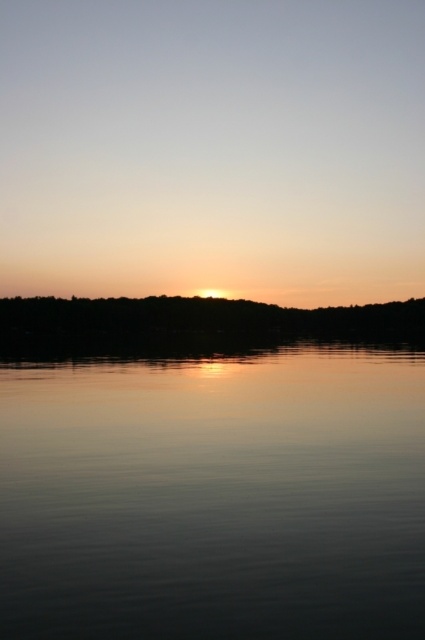
Question: Can you confirm if smooth water at center is wider than golden reflective sky at center?

Choices:
 (A) yes
 (B) no

Answer: (B)

Question: Which of the following is the closest to the observer?

Choices:
 (A) golden reflective sky at center
 (B) smooth water at center

Answer: (B)

Question: Which object appears closest to the camera in this image?

Choices:
 (A) golden reflective sky at center
 (B) smooth water at center

Answer: (B)

Question: Is smooth water at center bigger than golden reflective sky at center?

Choices:
 (A) yes
 (B) no

Answer: (B)

Question: Among these objects, which one is nearest to the camera?

Choices:
 (A) golden reflective sky at center
 (B) smooth water at center

Answer: (B)

Question: Is the position of smooth water at center more distant than that of golden reflective sky at center?

Choices:
 (A) yes
 (B) no

Answer: (B)